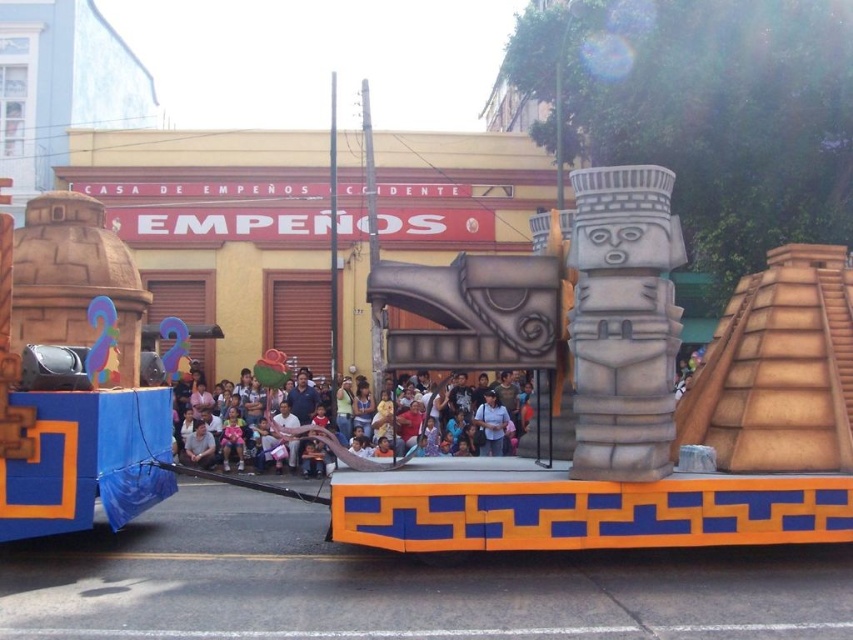
You are a photographer standing in the crowd watching the parade. You want to take a photo that includes both the light brown fabric at center and the matte pink shirt at center. What is the minimum distance you need to move backward to ensure both objects are fully visible in your camera frame?

The light brown fabric at center and the matte pink shirt at center are 1.04 meters apart from each other. To capture both in the frame, you need to move back until the distance between them fits within your camera lens field of view. Assuming a standard lens, moving back approximately 2 meters should allow both objects to be visible, as the separation of 1.04 meters would occupy a smaller portion of the frame from that distance.

You are a photographer taking a picture of the parade float. You notice the light brown fabric at center and the matte pink shirt at center. Which object should you focus on to capture the one that is taller?

The light brown fabric at center is taller than the matte pink shirt at center, so you should focus on the light brown fabric at center to capture the taller object.

You are a participant in the parade and you want to check if your light brown fabric at center is visible over your matte pink shirt at center. Can you confirm if it is?

The light brown fabric at center is positioned over matte pink shirt at center, so yes, the light brown fabric at center is visible over the matte pink shirt at center.